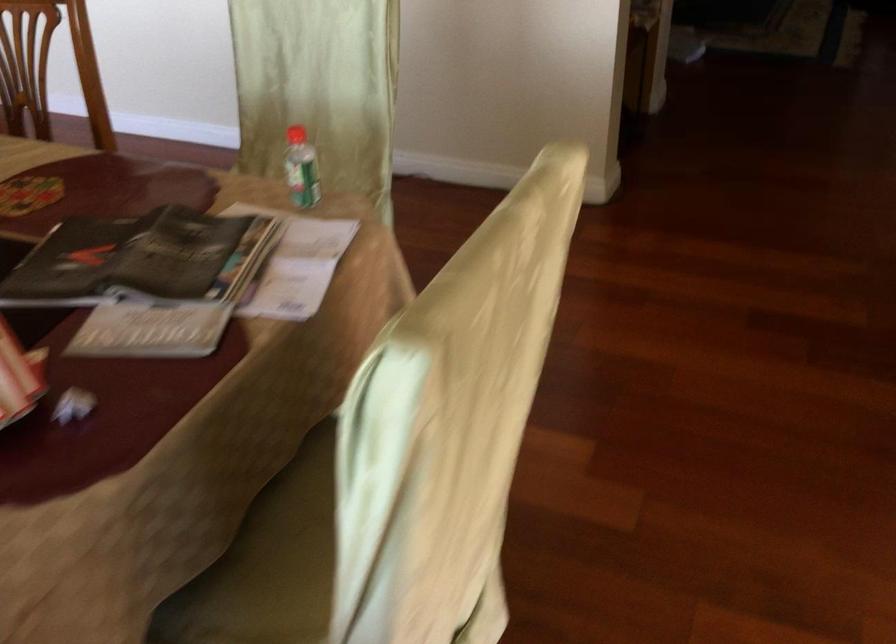
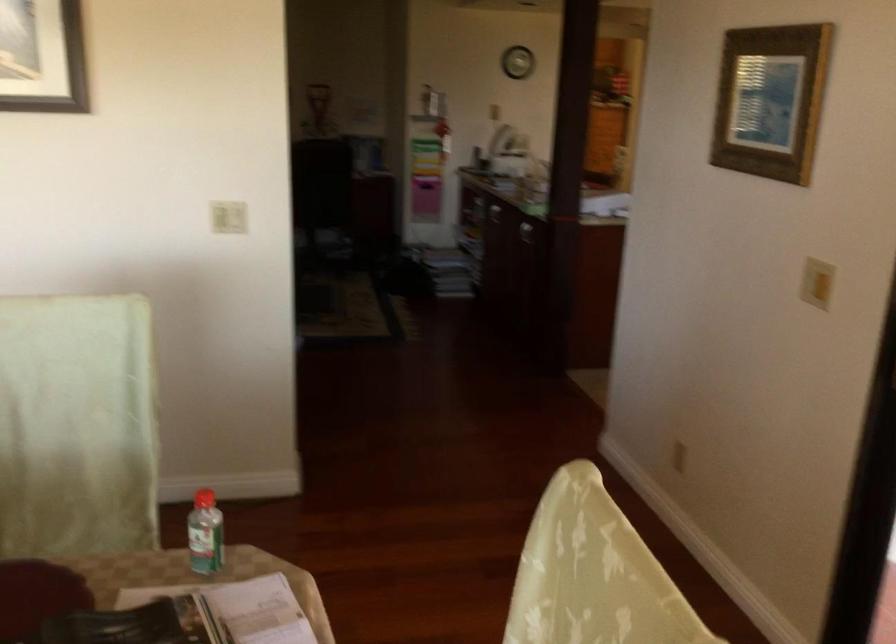
Locate, in the second image, the point that corresponds to [306,234] in the first image.

(238, 609)